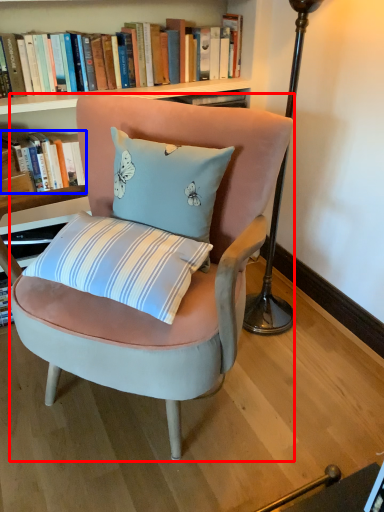
Question: Which of the following is the closest to the observer, chair (highlighted by a red box) or book (highlighted by a blue box)?

Choices:
 (A) chair
 (B) book

Answer: (A)